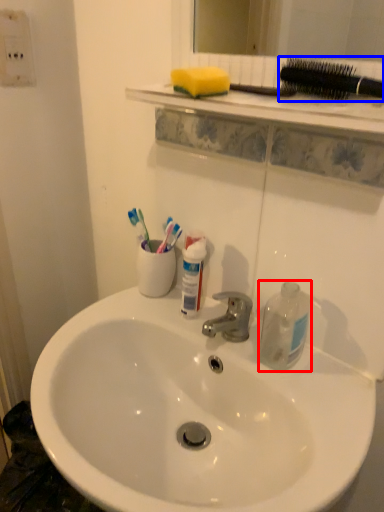
Question: Which of the following is the closest to the observer, cleaning product (highlighted by a red box) or brush (highlighted by a blue box)?

Choices:
 (A) cleaning product
 (B) brush

Answer: (B)